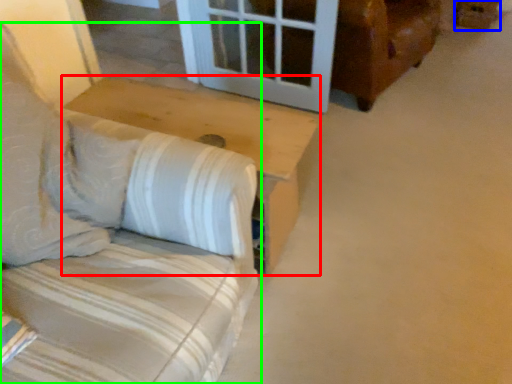
Question: Considering the real-world distances, which object is farthest from table (highlighted by a red box)? cardboard box (highlighted by a blue box) or furniture (highlighted by a green box)?

Choices:
 (A) cardboard box
 (B) furniture

Answer: (A)